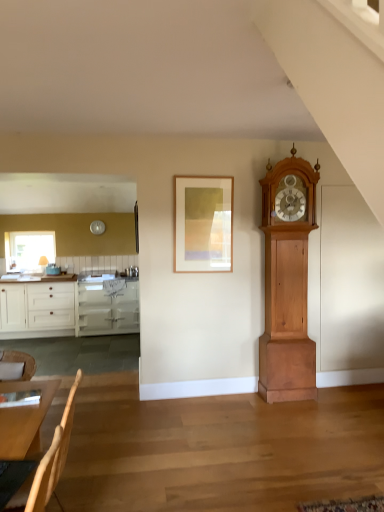
Question: Is wooden chair at lower left bigger than light wood armchair at lower left?

Choices:
 (A) no
 (B) yes

Answer: (A)

Question: Is wooden chair at lower left not within light wood armchair at lower left?

Choices:
 (A) yes
 (B) no

Answer: (A)

Question: Does wooden chair at lower left have a lesser width compared to light wood armchair at lower left?

Choices:
 (A) yes
 (B) no

Answer: (A)

Question: Is wooden chair at lower left further to the viewer compared to light wood armchair at lower left?

Choices:
 (A) yes
 (B) no

Answer: (A)

Question: Is wooden chair at lower left smaller than light wood armchair at lower left?

Choices:
 (A) no
 (B) yes

Answer: (B)

Question: Does wooden chair at lower left have a greater width compared to light wood armchair at lower left?

Choices:
 (A) yes
 (B) no

Answer: (B)

Question: Can you confirm if light brown wooden grandfather clock at right is bigger than wooden chair at lower left?

Choices:
 (A) yes
 (B) no

Answer: (A)

Question: From the image's perspective, is light brown wooden grandfather clock at right on wooden chair at lower left?

Choices:
 (A) yes
 (B) no

Answer: (A)

Question: Is light brown wooden grandfather clock at right not near wooden chair at lower left?

Choices:
 (A) no
 (B) yes

Answer: (B)

Question: Is light brown wooden grandfather clock at right thinner than wooden chair at lower left?

Choices:
 (A) yes
 (B) no

Answer: (B)

Question: Considering the relative sizes of light brown wooden grandfather clock at right and wooden chair at lower left in the image provided, is light brown wooden grandfather clock at right smaller than wooden chair at lower left?

Choices:
 (A) no
 (B) yes

Answer: (A)

Question: Does light brown wooden grandfather clock at right have a greater height compared to wooden chair at lower left?

Choices:
 (A) no
 (B) yes

Answer: (B)

Question: Does light brown wooden table at lower left come behind wooden picture frame at center?

Choices:
 (A) yes
 (B) no

Answer: (B)